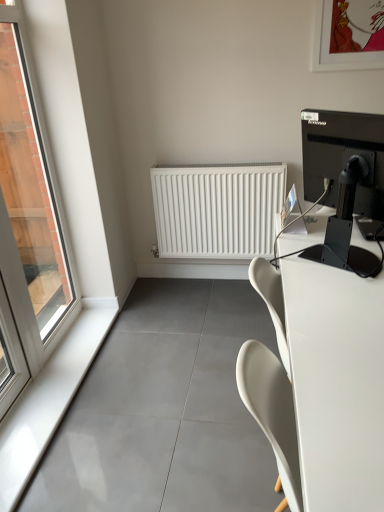
What do you see at coordinates (344, 161) in the screenshot? I see `black glossy monitor at upper right` at bounding box center [344, 161].

This screenshot has height=512, width=384. What do you see at coordinates (217, 209) in the screenshot?
I see `white matte radiator at center` at bounding box center [217, 209].

What do you see at coordinates (47, 402) in the screenshot? The height and width of the screenshot is (512, 384). I see `white glossy window sill at left` at bounding box center [47, 402].

Locate an element on the screen. white glossy desk at right is located at coordinates (336, 383).

Can white matte radiator at center be found inside white glossy window sill at left?

No.

Which of these two, white glossy window sill at left or white matte radiator at center, is bigger?

white matte radiator at center is bigger.

Is there a large distance between white glossy window sill at left and white matte radiator at center?

No, white glossy window sill at left is not far from white matte radiator at center.

Considering the positions of objects white glossy window sill at left and white matte radiator at center in the image provided, who is more to the right, white glossy window sill at left or white matte radiator at center?

white matte radiator at center is more to the right.

Considering the relative positions of white glossy window sill at left and white glossy desk at right in the image provided, is white glossy window sill at left to the right of white glossy desk at right from the viewer's perspective?

No.

How many degrees apart are the facing directions of white glossy window sill at left and white glossy desk at right?

white glossy window sill at left and white glossy desk at right are facing 0.252 degrees away from each other.

From a real-world perspective, is white glossy window sill at left under white glossy desk at right?

Yes, from a real-world perspective, white glossy window sill at left is below white glossy desk at right.

From the image's perspective, would you say white glossy window sill at left is shown under white glossy desk at right?

Indeed, from the image's perspective, white glossy window sill at left is shown beneath white glossy desk at right.

Would you say white matte radiator at center is inside or outside black glossy monitor at upper right?

white matte radiator at center exists outside the volume of black glossy monitor at upper right.

Can you confirm if white matte radiator at center is wider than black glossy monitor at upper right?

No, white matte radiator at center is not wider than black glossy monitor at upper right.

Between white matte radiator at center and black glossy monitor at upper right, which one is positioned in front?

Positioned in front is black glossy monitor at upper right.

From a real-world perspective, is white matte radiator at center physically below black glossy monitor at upper right?

Yes, from a real-world perspective, white matte radiator at center is below black glossy monitor at upper right.

Between white glossy window sill at left and clear glass window at left, which one has larger size?

clear glass window at left.

Considering their positions, is white glossy window sill at left located in front of or behind clear glass window at left?

Clearly, white glossy window sill at left is behind clear glass window at left.

Which is nearer, (94, 344) or (21, 120)?

Point (94, 344).

Is white glossy window sill at left next to clear glass window at left and touching it?

No.

In terms of size, does clear glass window at left appear bigger or smaller than white glossy window sill at left?

Considering their sizes, clear glass window at left takes up more space than white glossy window sill at left.

From the image's perspective, is clear glass window at left located above or below white glossy window sill at left?

Clearly, from the image's perspective, clear glass window at left is above white glossy window sill at left.

Is clear glass window at left facing towards white glossy window sill at left?

No, clear glass window at left does not turn towards white glossy window sill at left.

I want to click on window in front of the white glossy window sill at left, so click(x=28, y=225).

At what (x,y) coordinates should I click in order to perform the action: click on desk on the right side of clear glass window at left. Please return your answer as a coordinate pair (x, y). This screenshot has height=512, width=384. Looking at the image, I should click on (336, 383).

Does white glossy desk at right have a larger size compared to clear glass window at left?

Indeed, white glossy desk at right has a larger size compared to clear glass window at left.

Does white glossy desk at right turn towards clear glass window at left?

No.

Could you tell me if black glossy monitor at upper right is turned towards white glossy window sill at left?

No, black glossy monitor at upper right is not facing towards white glossy window sill at left.

Does point (321, 140) come in front of point (90, 339)?

Yes.

Considering the relative positions of black glossy monitor at upper right and white glossy window sill at left in the image provided, is black glossy monitor at upper right to the right of white glossy window sill at left from the viewer's perspective?

Yes.

Consider the image. Considering the sizes of black glossy monitor at upper right and white glossy window sill at left in the image, is black glossy monitor at upper right bigger or smaller than white glossy window sill at left?

In the image, black glossy monitor at upper right appears to be larger than white glossy window sill at left.

Find the location of `window sill in front of the white matte radiator at center`. window sill in front of the white matte radiator at center is located at coordinates (47, 402).

Locate an element on the screen. The height and width of the screenshot is (512, 384). window sill behind the white glossy desk at right is located at coordinates (47, 402).

In the scene shown: When comparing their distances from white glossy window sill at left, does clear glass window at left or white glossy desk at right seem further?

white glossy desk at right lies further to white glossy window sill at left than the other object.

Estimate the real-world distances between objects in this image. Which object is closer to white glossy window sill at left, black glossy monitor at upper right or clear glass window at left?

Based on the image, clear glass window at left appears to be nearer to white glossy window sill at left.

Based on the photo, based on their spatial positions, is white glossy desk at right or clear glass window at left further from black glossy monitor at upper right?

The object further to black glossy monitor at upper right is clear glass window at left.

In the scene shown: Which object lies nearer to the anchor point white glossy window sill at left, white glossy desk at right or white matte radiator at center?

The object closer to white glossy window sill at left is white matte radiator at center.

Looking at the image, which one is located further to white glossy desk at right, black glossy monitor at upper right or white matte radiator at center?

white matte radiator at center.

Which object lies further to the anchor point white glossy desk at right, black glossy monitor at upper right or clear glass window at left?

clear glass window at left.

When comparing their distances from clear glass window at left, does black glossy monitor at upper right or white glossy window sill at left seem closer?

white glossy window sill at left lies closer to clear glass window at left than the other object.

Based on their spatial positions, is black glossy monitor at upper right or white matte radiator at center closer to clear glass window at left?

white matte radiator at center lies closer to clear glass window at left than the other object.

I want to click on computer monitor located between clear glass window at left and white glossy desk at right in the left-right direction, so click(x=344, y=161).

Find the location of a particular element. Image resolution: width=384 pixels, height=512 pixels. computer monitor between white glossy window sill at left and white glossy desk at right in the horizontal direction is located at coordinates (344, 161).

Find the location of `window sill between white glossy desk at right and white matte radiator at center along the z-axis`. window sill between white glossy desk at right and white matte radiator at center along the z-axis is located at coordinates (47, 402).

Find the location of `radiator situated between clear glass window at left and black glossy monitor at upper right from left to right`. radiator situated between clear glass window at left and black glossy monitor at upper right from left to right is located at coordinates (217, 209).